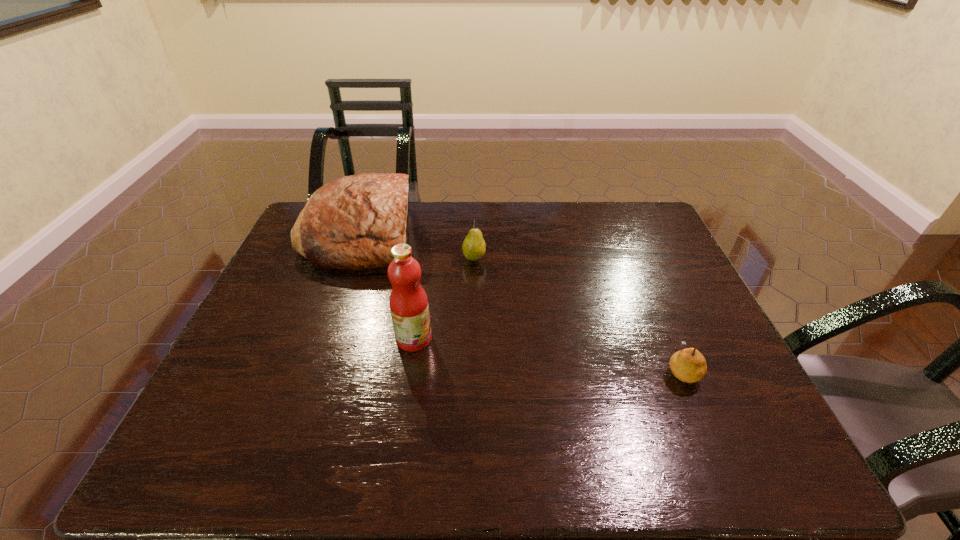
What are the coordinates of `the tallest object` in the screenshot? It's located at (409, 307).

Identify the location of the second object from left to right. (409, 307).

This screenshot has height=540, width=960. Find the location of `the leftmost object`. the leftmost object is located at coordinates (352, 222).

You are a GUI agent. You are given a task and a screenshot of the screen. Output one action in this format:
    pyautogui.click(x=<x>, y=<y>)
    Task: Click on the bread
    
    Given the screenshot: What is the action you would take?
    pyautogui.click(x=352, y=222)

The image size is (960, 540). In order to click on the taller pear in this screenshot , I will do `click(474, 247)`.

Identify the location of the third object from left to right. (474, 247).

Where is `the right pear`? the right pear is located at coordinates (688, 365).

The height and width of the screenshot is (540, 960). I want to click on the rightmost object, so click(x=688, y=365).

Identify the location of vacant space located on the front label of the third object from right to left. The height and width of the screenshot is (540, 960). (496, 339).

I want to click on vacant position located 0.360m at the sliced front of the third shortest object, so click(x=527, y=234).